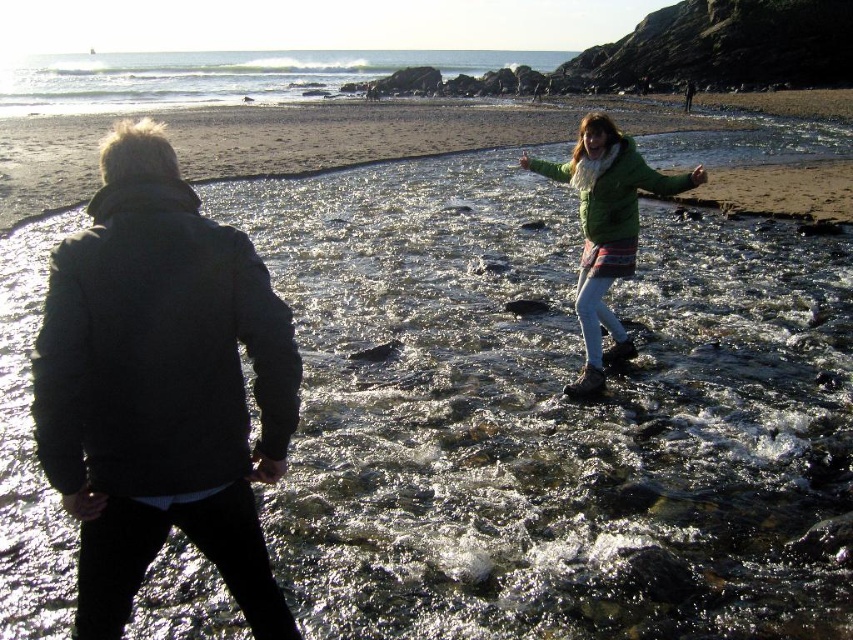
Based on the scene description, where is the smooth sand beach at upper center located in terms of coordinates?

The smooth sand beach at upper center is located at coordinates point (352,132).